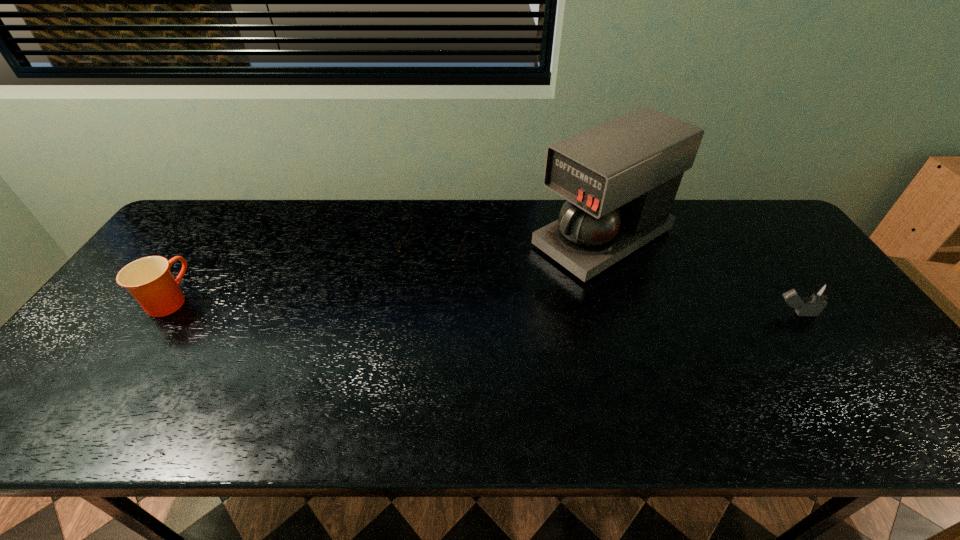
You are a GUI agent. You are given a task and a screenshot of the screen. Output one action in this format:
    pyautogui.click(x=<x>, y=<y>)
    Task: Click on the free region located 0.080m on the carafe side of the coffee maker
    The image size is (960, 540).
    Given the screenshot: What is the action you would take?
    pyautogui.click(x=530, y=278)

Where is `vacant position located 0.190m at the hinge ends of the shortest object`? vacant position located 0.190m at the hinge ends of the shortest object is located at coordinates (399, 325).

This screenshot has width=960, height=540. Identify the location of vacant space located 0.190m at the hinge ends of the shortest object. [x=399, y=325].

Locate an element on the screen. Image resolution: width=960 pixels, height=540 pixels. free space located 0.100m at the hinge ends of the shortest object is located at coordinates (412, 300).

Locate an element on the screen. coffee maker located at the far edge is located at coordinates (620, 178).

Locate an element on the screen. The width and height of the screenshot is (960, 540). spectacles present at the far edge is located at coordinates (443, 265).

Identify the location of object at the left edge. The height and width of the screenshot is (540, 960). (149, 280).

Locate an element on the screen. Image resolution: width=960 pixels, height=540 pixels. object that is at the right edge is located at coordinates (815, 302).

At what (x,y) coordinates should I click in order to perform the action: click on blank space at the far edge of the desktop. Please return your answer as a coordinate pair (x, y). The width and height of the screenshot is (960, 540). Looking at the image, I should click on (505, 238).

Identify the location of free region at the near edge. This screenshot has height=540, width=960. (749, 381).